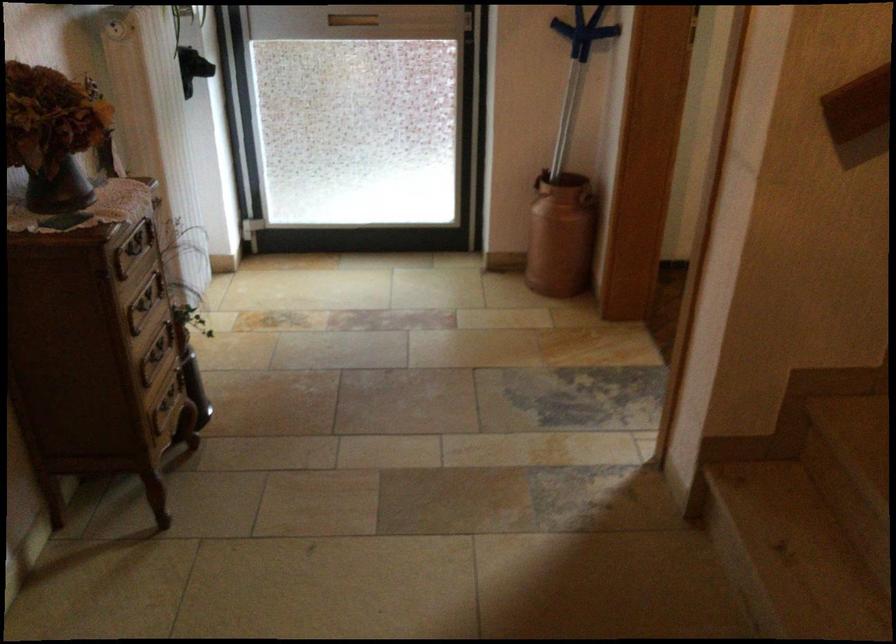
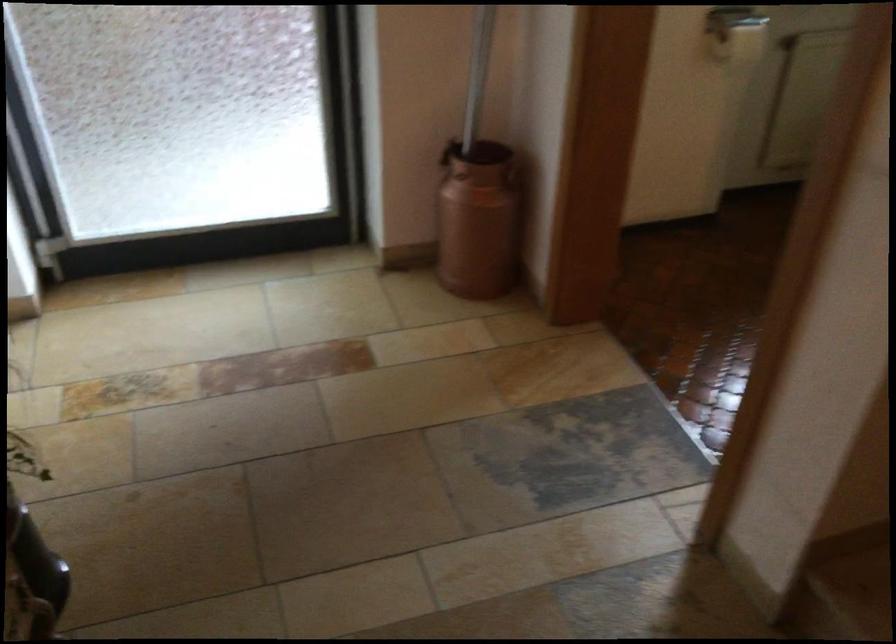
Where in the second image is the point corresponding to point (549, 229) from the first image?

(478, 220)